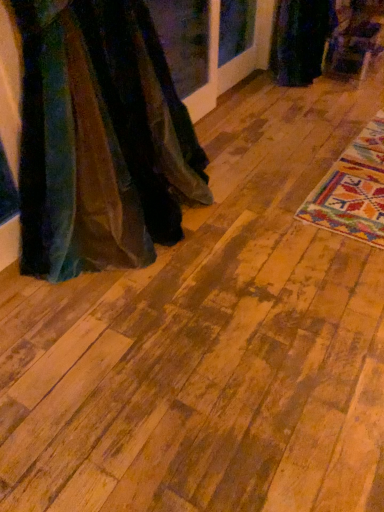
Where is `vacant space in front of velvet fabric dress at left, which appears as the 1th fancy dress when ordered from the bottom`? The height and width of the screenshot is (512, 384). vacant space in front of velvet fabric dress at left, which appears as the 1th fancy dress when ordered from the bottom is located at coordinates (104, 349).